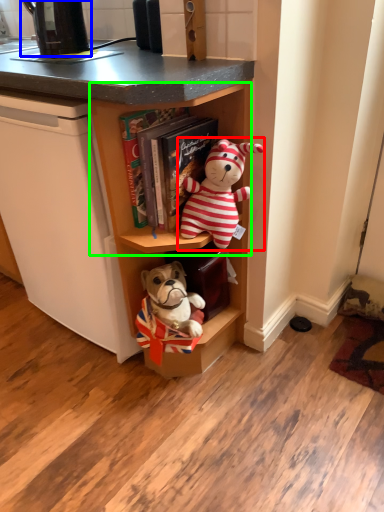
Question: Estimate the real-world distances between objects in this image. Which object is closer to toy (highlighted by a red box), appliance (highlighted by a blue box) or cabinet (highlighted by a green box)?

Choices:
 (A) appliance
 (B) cabinet

Answer: (B)